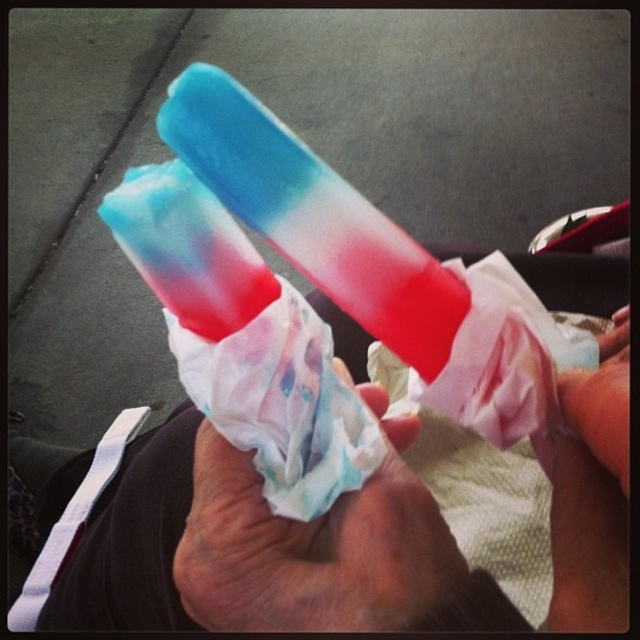
You are trying to clean up a spill on the sidewalk. You see a matte paper towel at center. Where exactly is the matte paper towel located in relation to the popsicles?

The matte paper towel at center is located at point (314, 545) in coordinates, which places it centrally positioned relative to the popsicles being held in the hands.

You are a delivery drone that needs to deliver a package to the person holding the translucent paper popsicle at center. The drone has a maximum delivery radius of 20 centimeters. Can the drone deliver the package to the person if it is currently positioned at the location of the matte plastic hand at lower right?

The distance between the translucent paper popsicle at center and the matte plastic hand at lower right is 20.87 centimeters. Since the drone has a maximum delivery radius of 20 centimeters, it cannot deliver the package as the distance exceeds its capability.